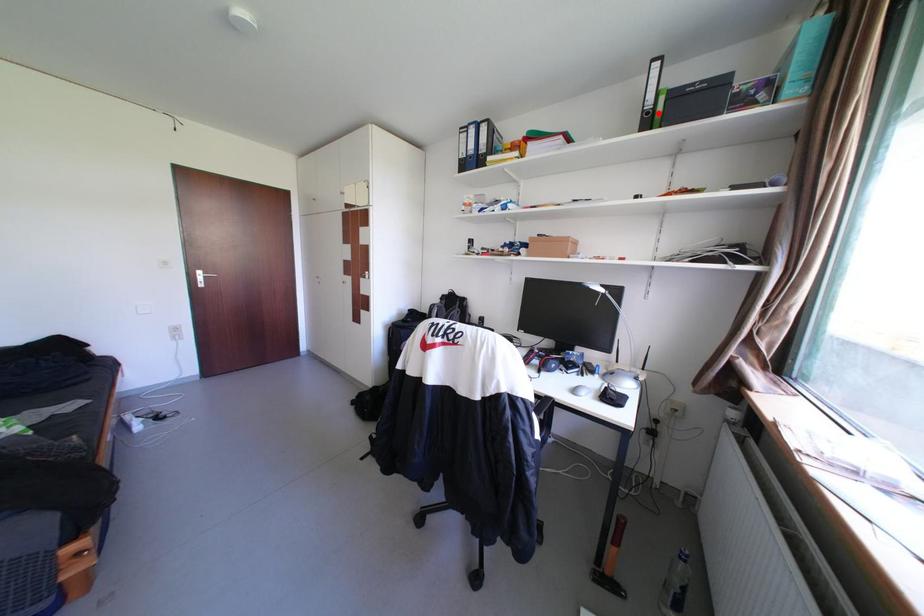
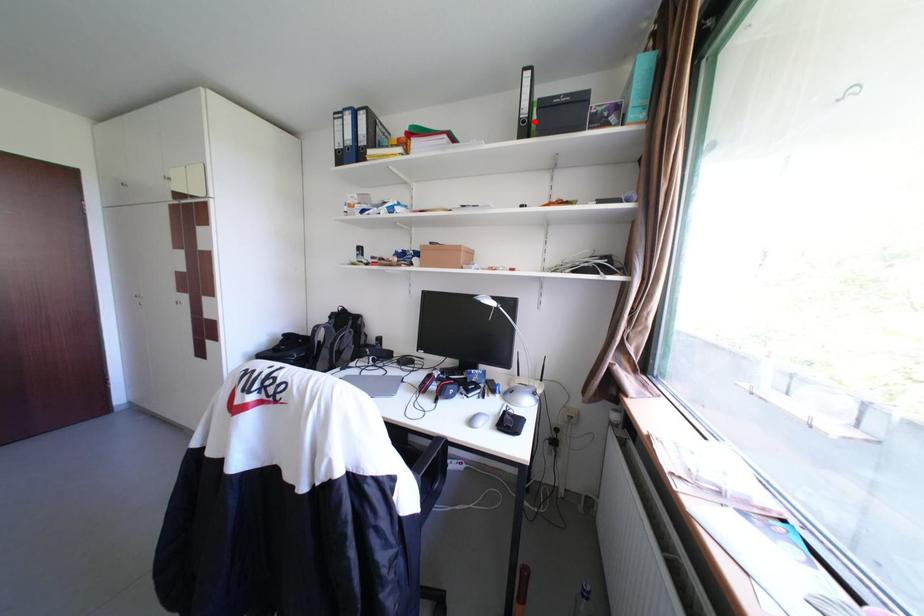
I am providing you with two images of the same scene from different viewpoints. A red point is marked on the first image and another point is marked on the second image. Are the points marked in image1 and image2 representing the same 3D position?

Yes